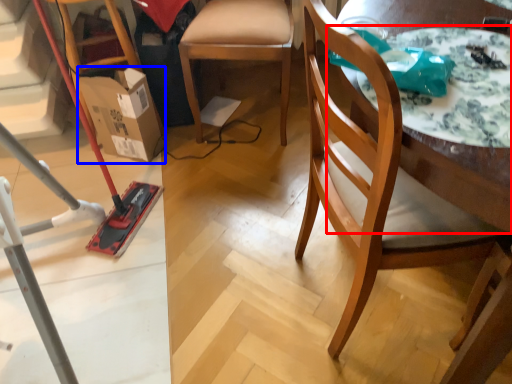
Question: Among these objects, which one is farthest to the camera, round table (highlighted by a red box) or cardboard box (highlighted by a blue box)?

Choices:
 (A) round table
 (B) cardboard box

Answer: (B)